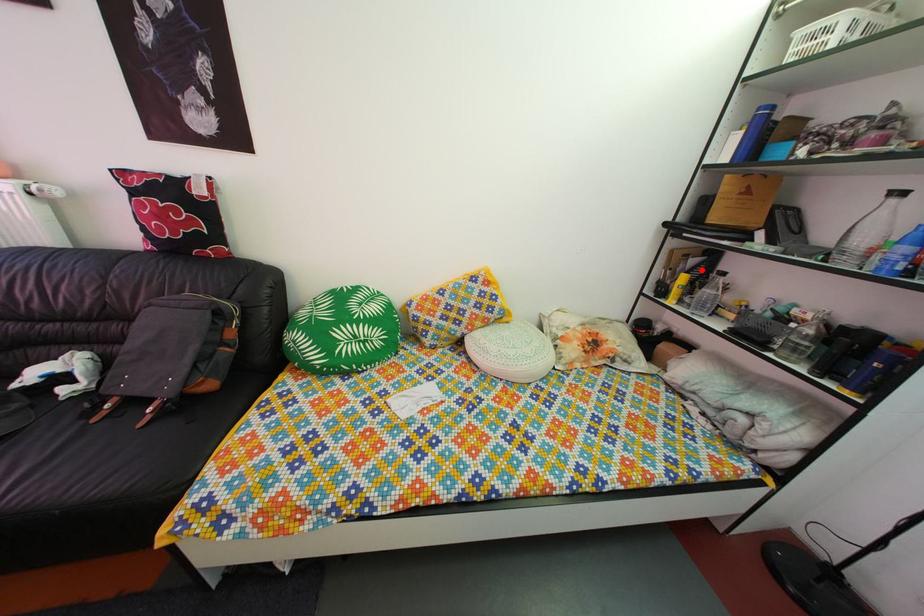
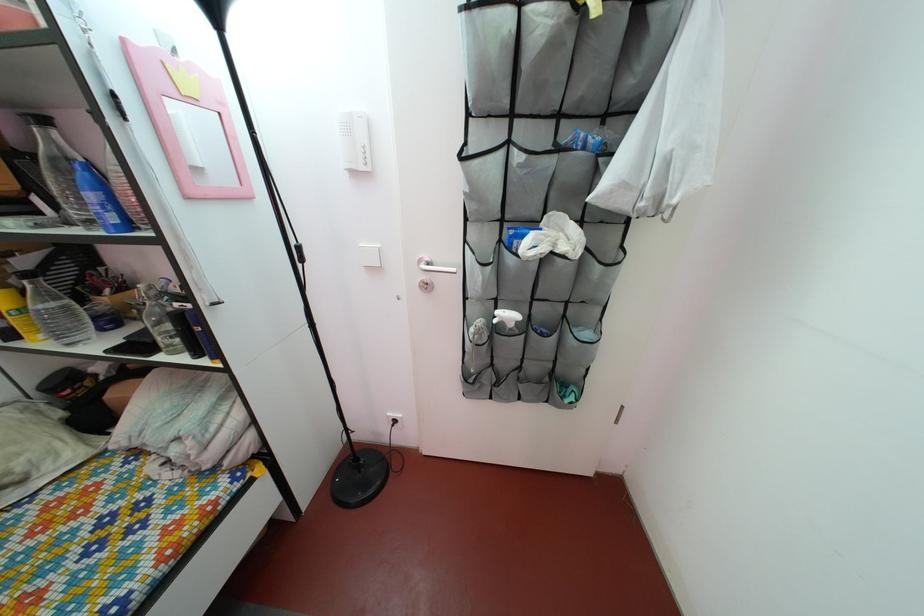
Question: A red point is marked in image1. In image2, is the corresponding 3D point closer to the camera or farther? Reply with the corresponding letter.

Choices:
 (A) The corresponding 3D point is closer.
 (B) The corresponding 3D point is farther.

Answer: (B)